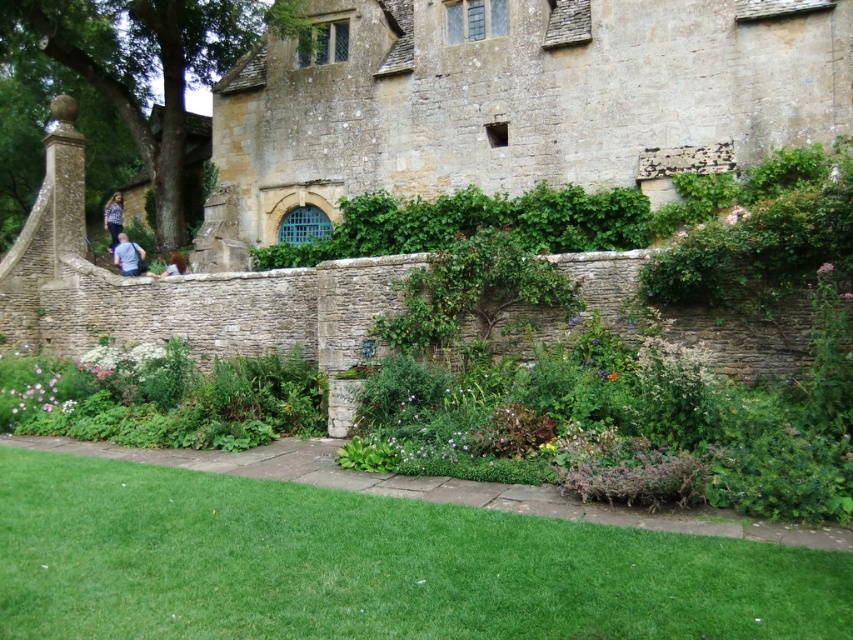
Consider the image. You are standing at the center of the lawn and want to plant a new flower bed. The green leafy hedge at center is in your way. To which direction should you move to avoid it?

The green leafy hedge at center is located at point 0.350 on the x axis and 0.557 on the y axis. Since you are at the center of the lawn, you should move in the direction away from the hedge. If the hedge is at 0.350 on the x axis, moving towards the right side of the lawn would take you away from it. Alternatively, moving towards the bottom of the frame would also help avoid the hedge as it is positioned higher up at 0.557 on the y axis.

You are a gardener standing at the base of the stone wall. You need to retrieve the denim jacket at upper left which is hanging on a hook. The green leafy hedge at center is blocking your path. Can you walk around the hedge to reach the jacket?

The green leafy hedge at center is 29.95 meters away from the denim jacket at upper left. Since the distance is quite large, you can easily walk around the hedge to reach the jacket.